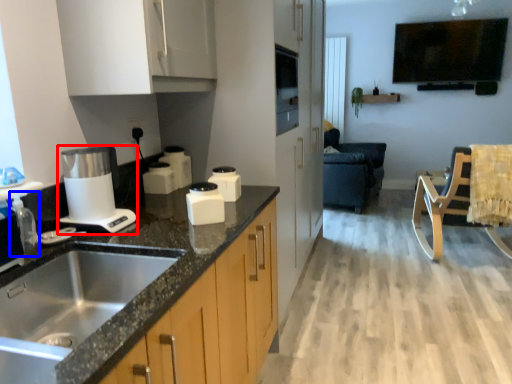
Question: Among these objects, which one is nearest to the camera, home appliance (highlighted by a red box) or faucet (highlighted by a blue box)?

Choices:
 (A) home appliance
 (B) faucet

Answer: (B)